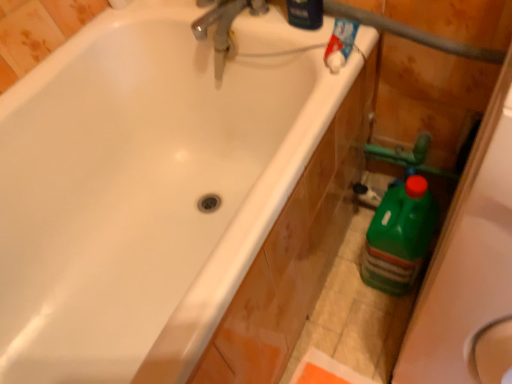
Question: Considering the relative sizes of metallic chrome faucet at upper center and green plastic bottle at right, which is the 2th cleaning product from left to right, in the image provided, is metallic chrome faucet at upper center taller than green plastic bottle at right, which is the 2th cleaning product from left to right,?

Choices:
 (A) no
 (B) yes

Answer: (A)

Question: Considering the relative sizes of metallic chrome faucet at upper center and green plastic bottle at right, which is counted as the first cleaning product, starting from the bottom, in the image provided, is metallic chrome faucet at upper center shorter than green plastic bottle at right, which is counted as the first cleaning product, starting from the bottom,?

Choices:
 (A) no
 (B) yes

Answer: (B)

Question: Does metallic chrome faucet at upper center have a larger size compared to green plastic bottle at right, which is the 2th cleaning product from left to right?

Choices:
 (A) no
 (B) yes

Answer: (A)

Question: From a real-world perspective, is metallic chrome faucet at upper center physically above green plastic bottle at right, which is the 2th cleaning product from left to right?

Choices:
 (A) yes
 (B) no

Answer: (A)

Question: Does metallic chrome faucet at upper center come in front of green plastic bottle at right, the 2th cleaning product viewed from the top?

Choices:
 (A) yes
 (B) no

Answer: (A)

Question: From the image's perspective, is white glossy bathtub at upper left positioned above or below green plastic bottle at right, the 2th cleaning product positioned from the front?

Choices:
 (A) below
 (B) above

Answer: (B)

Question: From a real-world perspective, is white glossy bathtub at upper left above or below green plastic bottle at right, which ranks as the 1th cleaning product in right-to-left order?

Choices:
 (A) below
 (B) above

Answer: (B)

Question: In terms of width, does white glossy bathtub at upper left look wider or thinner when compared to green plastic bottle at right, which is the 2th cleaning product from left to right?

Choices:
 (A) thin
 (B) wide

Answer: (B)

Question: In terms of height, does white glossy bathtub at upper left look taller or shorter compared to green plastic bottle at right, the 2th cleaning product viewed from the top?

Choices:
 (A) short
 (B) tall

Answer: (B)

Question: Relative to white glossy bathtub at upper left, is green plastic bottle at right, which is counted as the first cleaning product, starting from the bottom, in front or behind?

Choices:
 (A) behind
 (B) front

Answer: (A)

Question: From a real-world perspective, relative to white glossy bathtub at upper left, is green plastic bottle at right, which is the 2th cleaning product from left to right, vertically above or below?

Choices:
 (A) below
 (B) above

Answer: (A)

Question: Is point (416, 188) positioned closer to the camera than point (157, 357)?

Choices:
 (A) farther
 (B) closer

Answer: (A)

Question: From the image's perspective, is green plastic bottle at right, which ranks as the 1th cleaning product in right-to-left order, positioned above or below white glossy bathtub at upper left?

Choices:
 (A) below
 (B) above

Answer: (A)

Question: Is blue glossy bottle at upper right, placed as the 1th cleaning product when sorted from top to bottom, wider or thinner than white glossy bathtub at upper left?

Choices:
 (A) wide
 (B) thin

Answer: (B)

Question: Is blue glossy bottle at upper right, which ranks as the 1th cleaning product in front-to-back order, inside or outside of white glossy bathtub at upper left?

Choices:
 (A) outside
 (B) inside

Answer: (A)